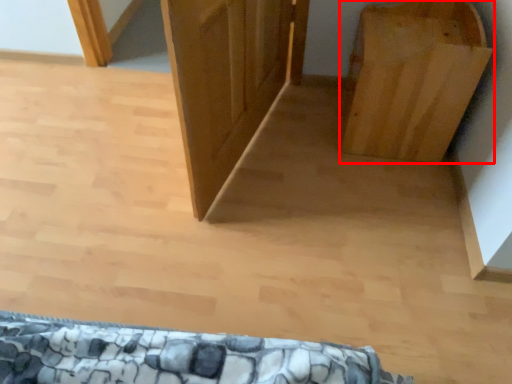
Question: Considering the relative positions of furniture (annotated by the red box) and door in the image provided, where is furniture (annotated by the red box) located with respect to the staircase?

Choices:
 (A) right
 (B) left

Answer: (A)